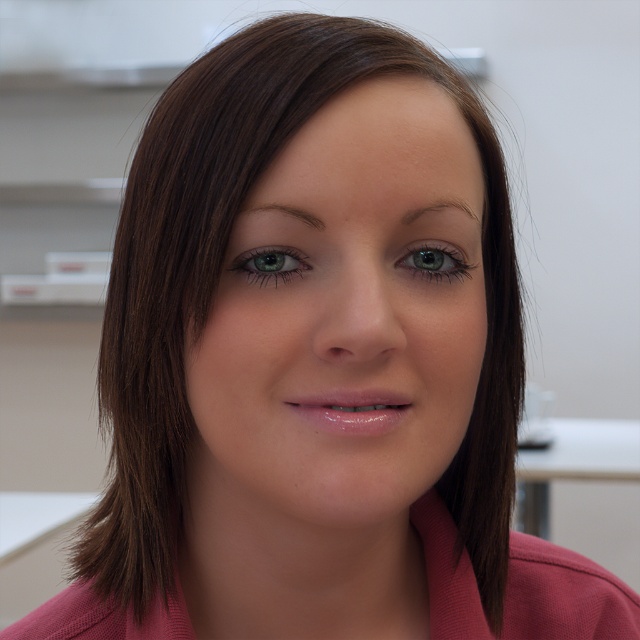
Does point (310, 221) come closer to viewer compared to point (413, 243)?

Yes, it is.

I want to click on smooth skin face at center, so tap(342, 324).

Who is more forward, (220, 308) or (422, 248)?

Point (220, 308) is in front.

The height and width of the screenshot is (640, 640). I want to click on smooth skin face at center, so click(342, 324).

Can you confirm if smooth skin face at center is bigger than green matte eye at center?

Yes, smooth skin face at center is bigger than green matte eye at center.

Looking at this image, between smooth skin face at center and green matte eye at center, which one has more height?

With more height is smooth skin face at center.

In order to click on smooth skin face at center in this screenshot , I will do `click(342, 324)`.

Is the position of green matte eye at center more distant than that of green glossy eye at center?

No, green matte eye at center is in front of green glossy eye at center.

Find the location of `green matte eye at center`. green matte eye at center is located at coordinates (268, 264).